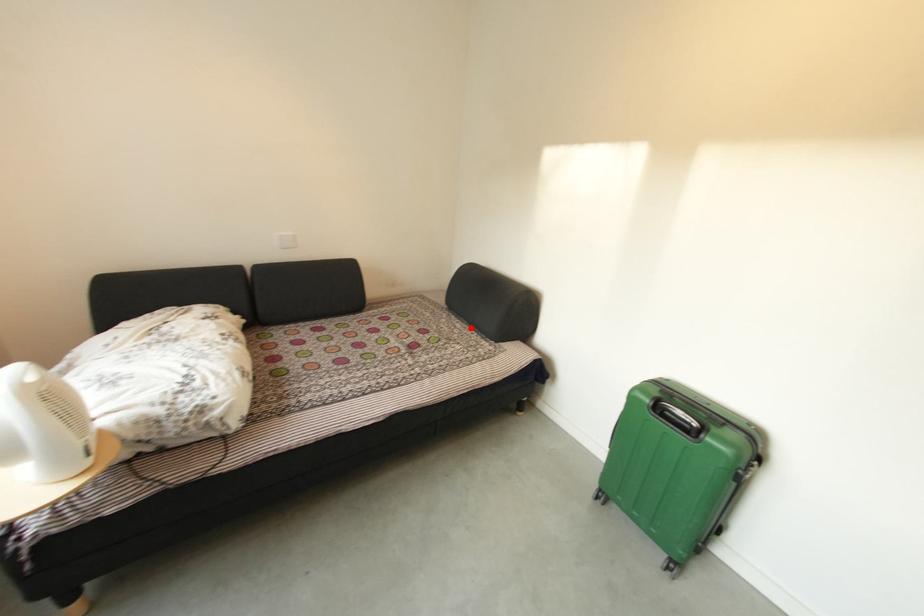
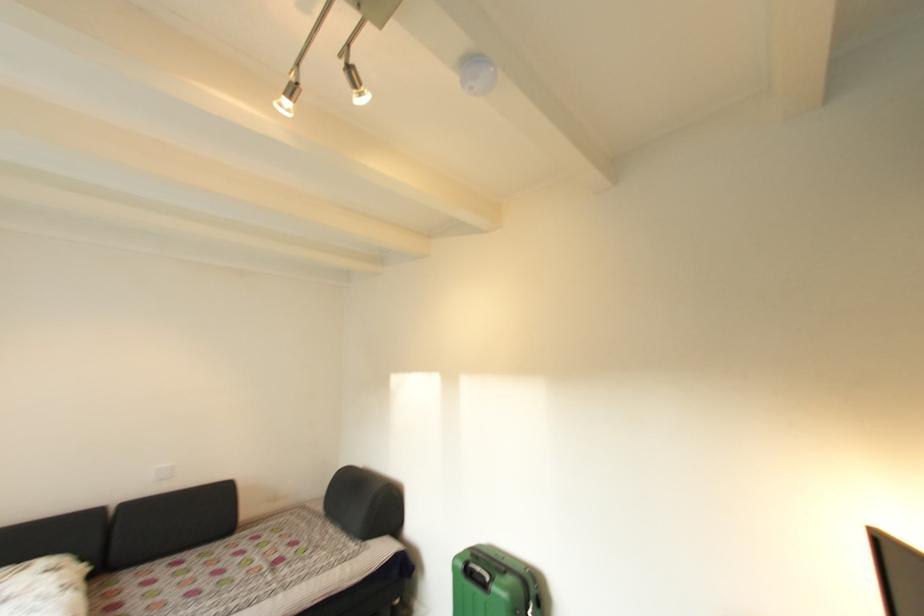
Find the pixel in the second image that matches the highlighted location in the first image.

(344, 533)